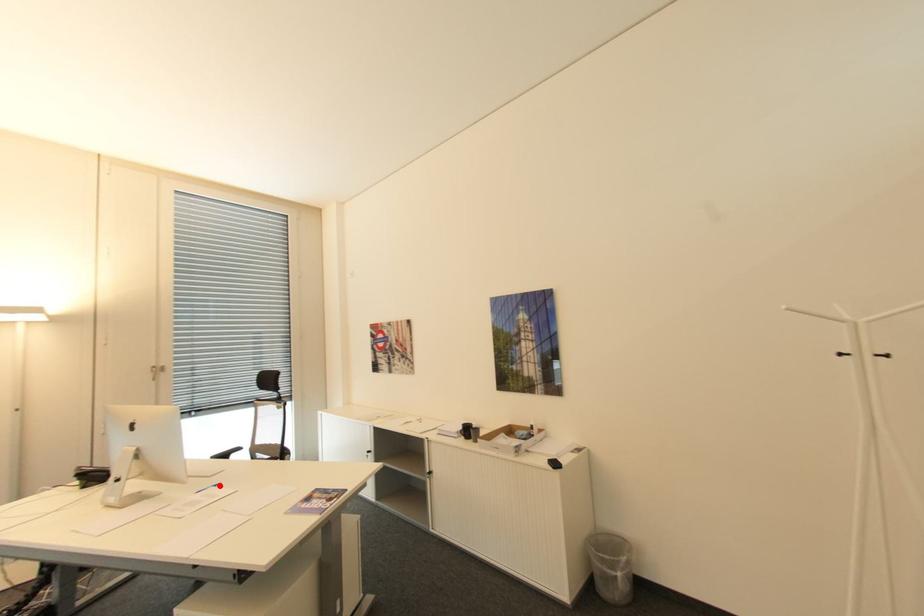
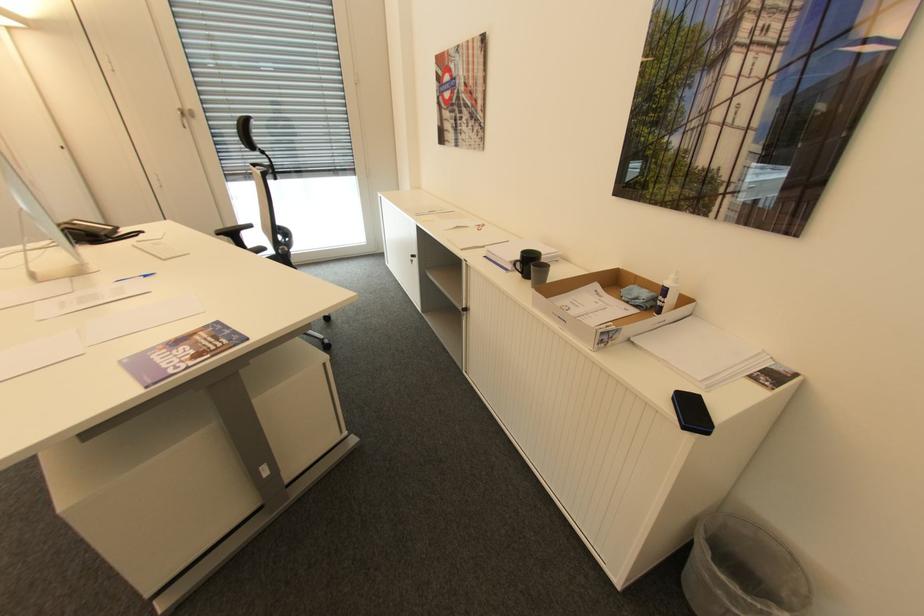
Where in the second image is the point corresponding to the highlighted location from the first image?

(150, 276)